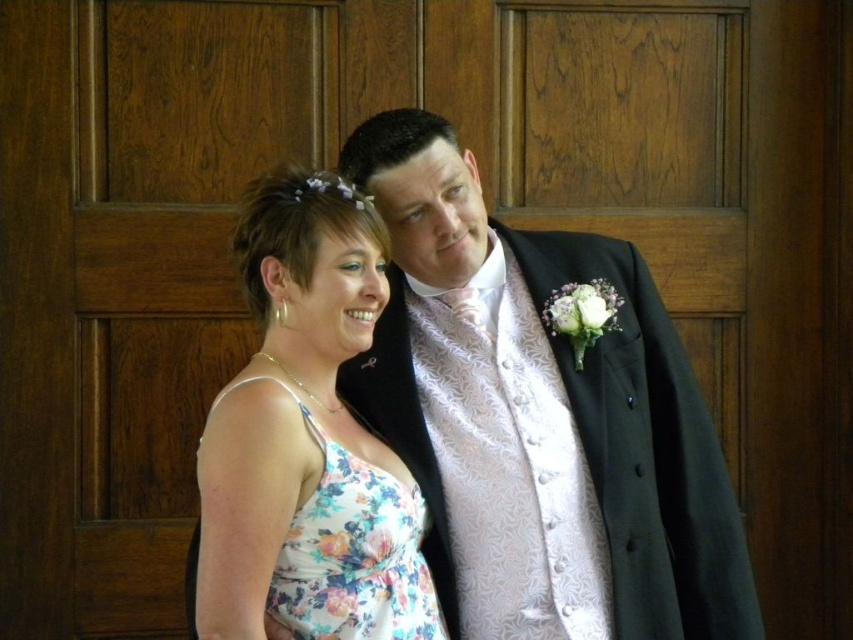
Question: Where is floral dress at center located in relation to floral fabric dress at center in the image?

Choices:
 (A) below
 (B) above

Answer: (A)

Question: Which object appears farthest from the camera in this image?

Choices:
 (A) floral fabric dress at center
 (B) floral dress at center

Answer: (B)

Question: Does floral dress at center have a greater width compared to floral fabric dress at center?

Choices:
 (A) no
 (B) yes

Answer: (B)

Question: Can you confirm if floral dress at center is bigger than floral fabric dress at center?

Choices:
 (A) yes
 (B) no

Answer: (A)

Question: Which point is farther to the camera?

Choices:
 (A) floral fabric dress at center
 (B) floral dress at center

Answer: (B)